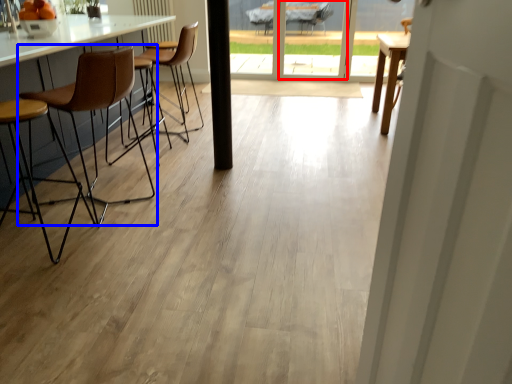
Question: Which object appears farthest to the camera in this image, screen door (highlighted by a red box) or chair (highlighted by a blue box)?

Choices:
 (A) screen door
 (B) chair

Answer: (A)